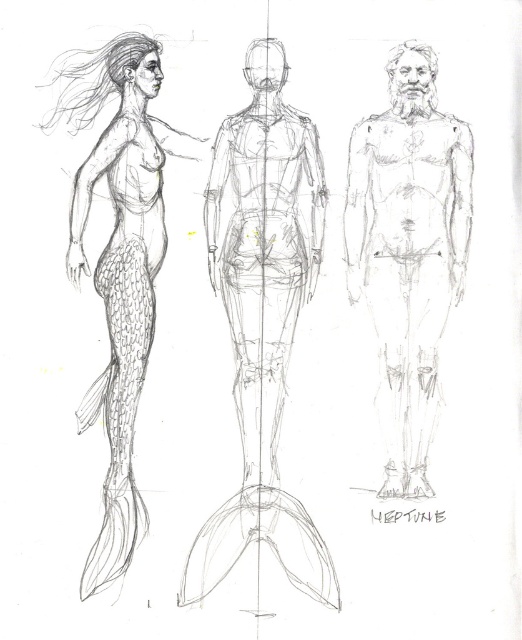
Question: Which point is closer to the camera taking this photo?

Choices:
 (A) (140, 236)
 (B) (223, 547)
 (C) (418, 342)

Answer: (B)

Question: Can you confirm if smooth skin figure at center is positioned above smooth gray tail at left?

Choices:
 (A) no
 (B) yes

Answer: (B)

Question: Can you confirm if smooth pencil sketch of humanoid figure at center is smaller than smooth gray tail at left?

Choices:
 (A) no
 (B) yes

Answer: (B)

Question: Can you confirm if smooth skin figure at center is positioned to the left of smooth gray tail at left?

Choices:
 (A) yes
 (B) no

Answer: (B)

Question: Among these objects, which one is farthest from the camera?

Choices:
 (A) smooth gray tail at left
 (B) smooth skin figure at center
 (C) smooth pencil sketch of humanoid figure at center

Answer: (C)

Question: Which is farther from the smooth skin figure at center?

Choices:
 (A) smooth pencil sketch of humanoid figure at center
 (B) smooth gray tail at left

Answer: (B)